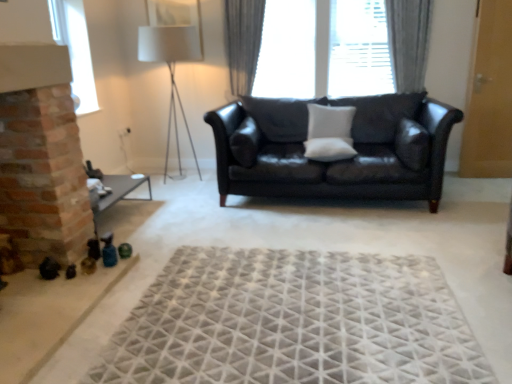
Question: From the image's perspective, would you say white matte pillow at center, arranged as the third pillow when viewed from the right, is positioned over transparent glass window at center, positioned as the 1th window in right-to-left order?

Choices:
 (A) no
 (B) yes

Answer: (A)

Question: Does white matte pillow at center, arranged as the third pillow when viewed from the right, have a lesser width compared to transparent glass window at center, marked as the second window in a left-to-right arrangement?

Choices:
 (A) yes
 (B) no

Answer: (B)

Question: Could you tell me if white matte pillow at center, the 1th pillow in the left-to-right sequence, is facing transparent glass window at center, which is counted as the second window, starting from the front?

Choices:
 (A) no
 (B) yes

Answer: (A)

Question: Is white matte pillow at center, the 1th pillow in the left-to-right sequence, at the right side of transparent glass window at center, marked as the second window in a left-to-right arrangement?

Choices:
 (A) yes
 (B) no

Answer: (B)

Question: Considering the relative sizes of white matte pillow at center, arranged as the third pillow when viewed from the right, and transparent glass window at center, positioned as the 1th window in right-to-left order, in the image provided, is white matte pillow at center, arranged as the third pillow when viewed from the right, taller than transparent glass window at center, positioned as the 1th window in right-to-left order,?

Choices:
 (A) no
 (B) yes

Answer: (A)

Question: From a real-world perspective, is white matte pillow at center, arranged as the third pillow when viewed from the right, over transparent glass window at center, which is counted as the second window, starting from the front?

Choices:
 (A) no
 (B) yes

Answer: (A)

Question: Can you confirm if gray fabric curtain at upper center, the second curtain when ordered from right to left, is thinner than suede-like dark brown pillow at right, which ranks as the 1th pillow in right-to-left order?

Choices:
 (A) no
 (B) yes

Answer: (B)

Question: Can you confirm if gray fabric curtain at upper center, the first curtain positioned from the left, is taller than suede-like dark brown pillow at right, which is the third pillow from left to right?

Choices:
 (A) yes
 (B) no

Answer: (A)

Question: Does gray fabric curtain at upper center, the first curtain positioned from the left, appear on the right side of suede-like dark brown pillow at right, which ranks as the 1th pillow in right-to-left order?

Choices:
 (A) no
 (B) yes

Answer: (A)

Question: Can you confirm if gray fabric curtain at upper center, the second curtain when ordered from right to left, is bigger than suede-like dark brown pillow at right, which is the third pillow from left to right?

Choices:
 (A) no
 (B) yes

Answer: (B)

Question: From the image's perspective, is gray fabric curtain at upper center, the second curtain when ordered from right to left, on top of suede-like dark brown pillow at right, which is the third pillow from left to right?

Choices:
 (A) no
 (B) yes

Answer: (B)

Question: Is gray fabric curtain at upper center, the second curtain when ordered from right to left, to the left of suede-like dark brown pillow at right, which ranks as the 1th pillow in right-to-left order, from the viewer's perspective?

Choices:
 (A) yes
 (B) no

Answer: (A)

Question: Considering the relative sizes of white matte pillow at center, the 1th pillow in the left-to-right sequence, and shiny black leather couch at center in the image provided, is white matte pillow at center, the 1th pillow in the left-to-right sequence, thinner than shiny black leather couch at center?

Choices:
 (A) no
 (B) yes

Answer: (B)